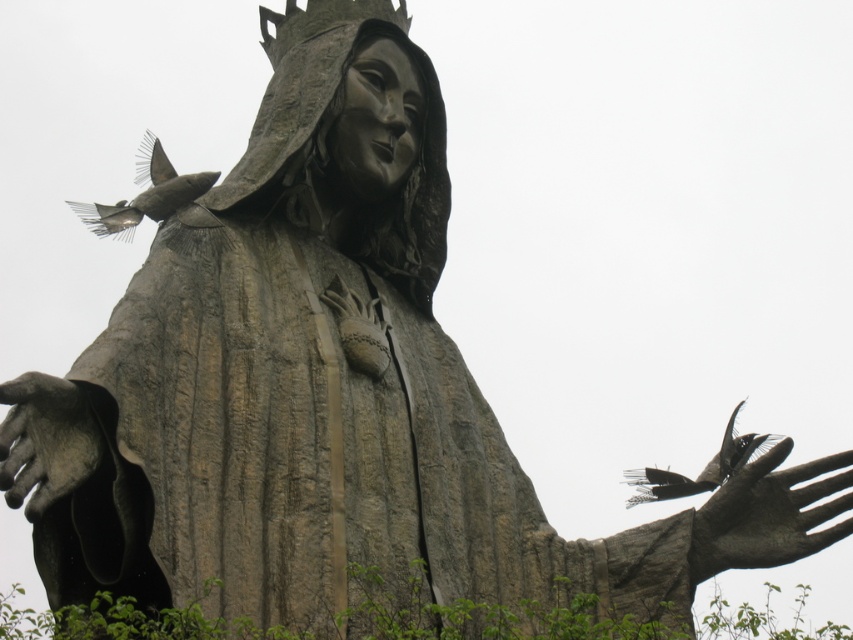
You are standing in front of the statue and want to touch the gray stone hand at right and the dark gray feathers at right. Which object will your hand reach first?

The gray stone hand at right is closer to the viewer than the dark gray feathers at right, so you will reach the gray stone hand at right first.

Based on the scene description, where is the gray stone hand at right located in terms of coordinates?

The gray stone hand at right is located at point (769, 515).

You are a small bird trying to land on the gray stone hand at right and the dark gray feathers at right. Which surface would you choose if you want a wider area to perch on?

The dark gray feathers at right have a greater width than the gray stone hand at right, so you should choose the dark gray feathers at right for a wider perching area.